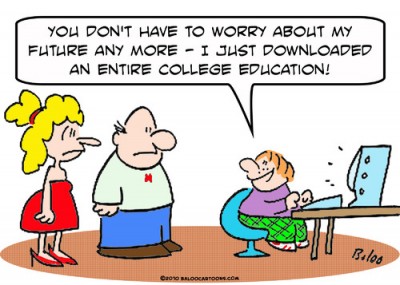
Locate an element on the screen. chair is located at coordinates (227, 221).